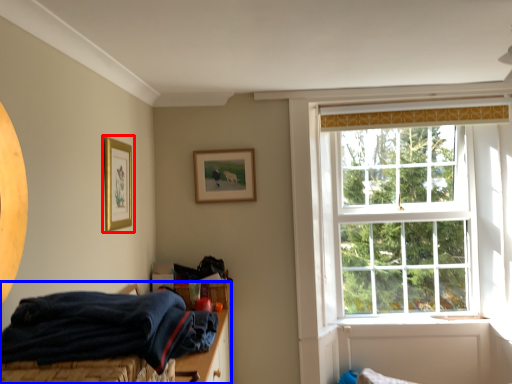
Question: Among these objects, which one is nearest to the camera, picture frame (highlighted by a red box) or bed (highlighted by a blue box)?

Choices:
 (A) picture frame
 (B) bed

Answer: (B)